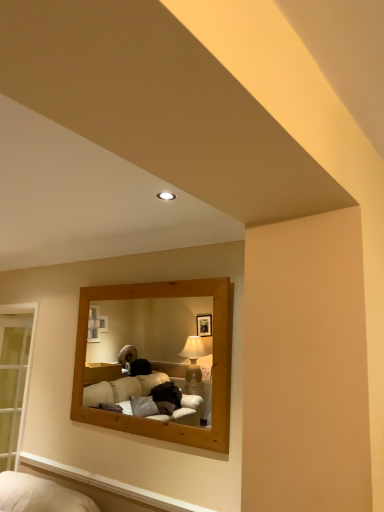
Measure the distance between clear glass door at left and camera.

clear glass door at left is 11.24 feet from camera.

Identify the location of clear glass door at left. Image resolution: width=384 pixels, height=512 pixels. 14,376.

The width and height of the screenshot is (384, 512). Describe the element at coordinates (14, 376) in the screenshot. I see `clear glass door at left` at that location.

The height and width of the screenshot is (512, 384). I want to click on clear glass door at left, so click(x=14, y=376).